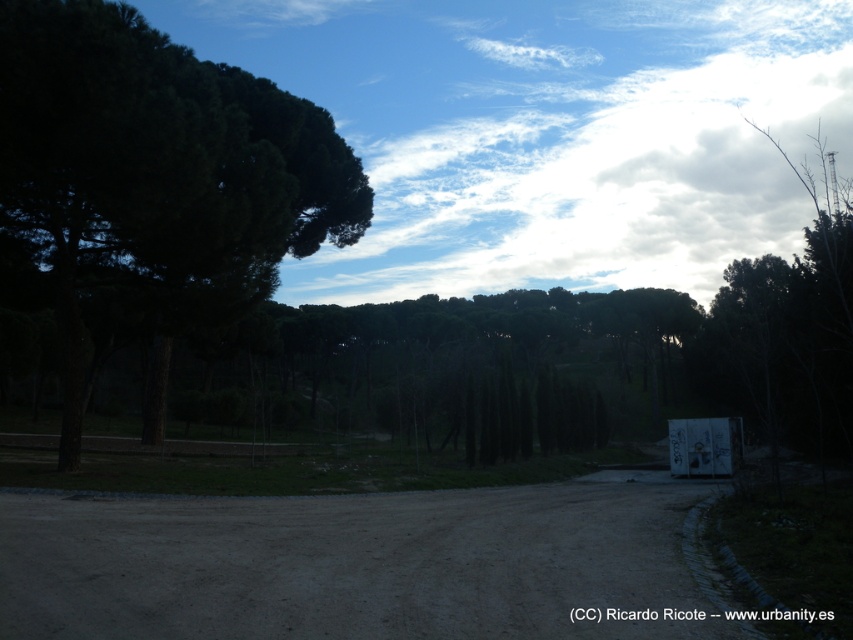
Question: Among these points, which one is nearest to the camera?

Choices:
 (A) (315, 531)
 (B) (358, 216)

Answer: (A)

Question: Does dirt track at center come behind dark green textured tree at left?

Choices:
 (A) yes
 (B) no

Answer: (B)

Question: Which point appears farthest from the camera in this image?

Choices:
 (A) 64,428
 (B) 538,577

Answer: (A)

Question: Does dirt track at center appear on the left side of dark green textured tree at left?

Choices:
 (A) no
 (B) yes

Answer: (A)

Question: Which of the following is the farthest from the observer?

Choices:
 (A) dark green textured tree at left
 (B) dirt track at center

Answer: (A)

Question: Can you confirm if dirt track at center is wider than dark green textured tree at left?

Choices:
 (A) no
 (B) yes

Answer: (A)